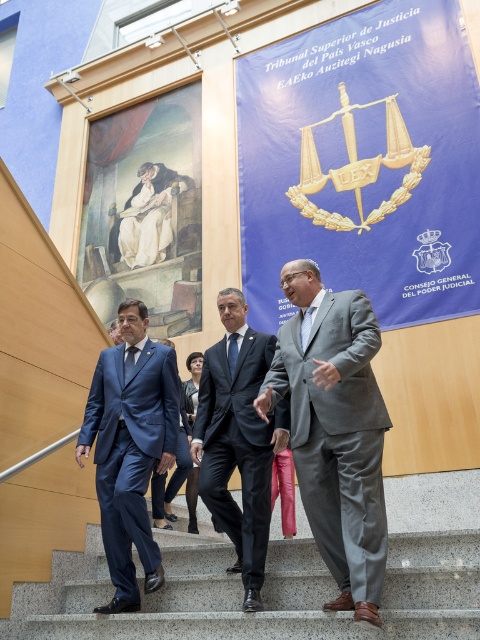
Does granite stairs at center have a greater width compared to matte blue suit at center?

Yes, granite stairs at center is wider than matte blue suit at center.

Consider the image. Who is more distant from viewer, (176, 600) or (111, 532)?

Positioned behind is point (176, 600).

Where is `granite stairs at center`? Image resolution: width=480 pixels, height=640 pixels. granite stairs at center is located at coordinates (263, 595).

Who is positioned more to the right, gray suit at center or matte blue suit at center?

From the viewer's perspective, gray suit at center appears more on the right side.

Between gray suit at center and matte blue suit at center, which one is positioned higher?

gray suit at center is higher up.

Which is behind, point (290, 394) or point (147, 394)?

The point (147, 394) is behind.

Where is `gray suit at center`? The height and width of the screenshot is (640, 480). gray suit at center is located at coordinates (335, 429).

Can you confirm if blue fabric banner at center is bigger than matte blue suit at center?

Correct, blue fabric banner at center is larger in size than matte blue suit at center.

Is blue fabric banner at center shorter than matte blue suit at center?

Incorrect, blue fabric banner at center's height does not fall short of matte blue suit at center's.

Who is more forward, (x=399, y=74) or (x=105, y=513)?

Point (x=105, y=513) is more forward.

Locate an element on the screen. The width and height of the screenshot is (480, 640). blue fabric banner at center is located at coordinates (363, 163).